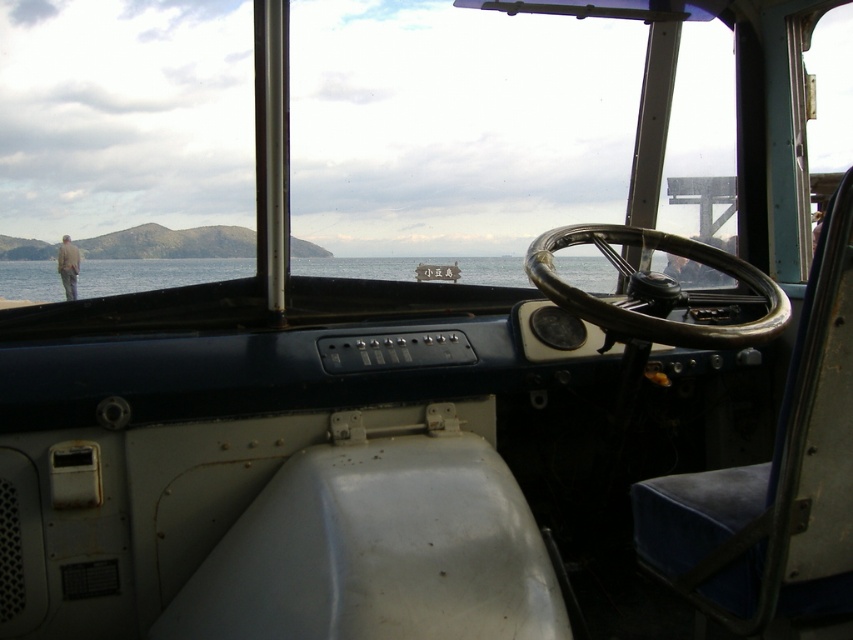
You are a passenger on a boat and you see a light brown leather jacket at center and a wooden signboard at center. Which object is bigger?

The light brown leather jacket at center has a larger size compared to the wooden signboard at center, so the light brown leather jacket at center is bigger.

You are a passenger in the boat and want to know which object is taller between the shiny chrome steering wheel at center and the wooden signboard at center. Can you tell me?

The shiny chrome steering wheel at center is taller than the wooden signboard at center.

You are a passenger in the boat and need to know which object at the center of the dashboard is wider. Can you tell me which one is wider between the shiny chrome steering wheel at center and the wooden signboard at center?

The shiny chrome steering wheel at center is wider than the wooden signboard at center.